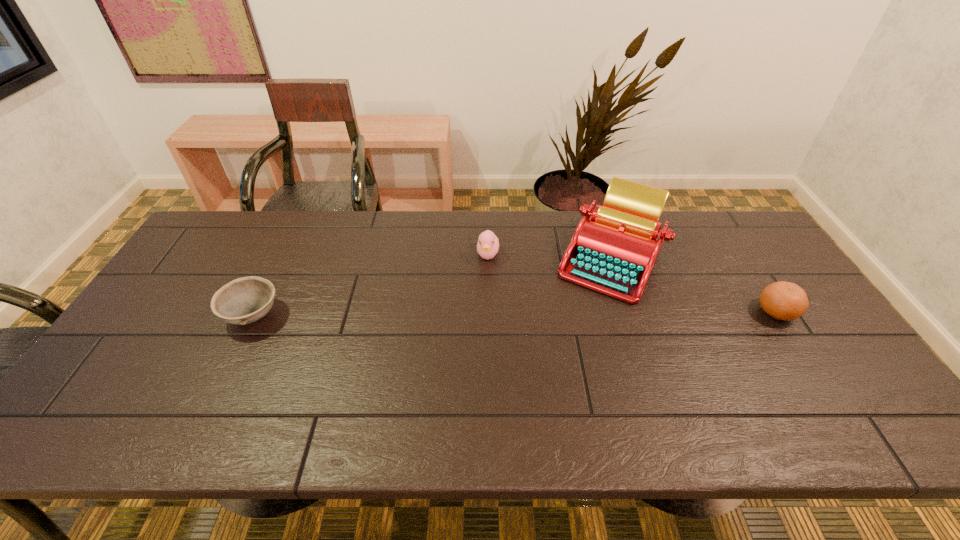
You are a GUI agent. You are given a task and a screenshot of the screen. Output one action in this format:
    pyautogui.click(x=<x>, y=<y>)
    Task: Click on the empty location between the second object from left to right and the tallest object
    This screenshot has height=540, width=960.
    Given the screenshot: What is the action you would take?
    pyautogui.click(x=549, y=256)

This screenshot has width=960, height=540. What are the coordinates of `vacant space in between the typewriter and the bowl` in the screenshot? It's located at pyautogui.click(x=432, y=287).

Locate an element on the screen. The width and height of the screenshot is (960, 540). unoccupied area between the tallest object and the rightmost object is located at coordinates (693, 285).

At what (x,y) coordinates should I click in order to perform the action: click on the third closest object to the tallest object. Please return your answer as a coordinate pair (x, y). The width and height of the screenshot is (960, 540). Looking at the image, I should click on (246, 300).

At what (x,y) coordinates should I click in order to perform the action: click on the third closest object to the rightmost object. Please return your answer as a coordinate pair (x, y). The image size is (960, 540). Looking at the image, I should click on (246, 300).

You are a GUI agent. You are given a task and a screenshot of the screen. Output one action in this format:
    pyautogui.click(x=<x>, y=<y>)
    Task: Click on the vacant region that satisfies the following two spatial constraints: 1. on the front side of the duckling; 2. on the right side of the clementine
    The image size is (960, 540).
    Given the screenshot: What is the action you would take?
    pyautogui.click(x=489, y=312)

Find the location of a particular element. vacant space that satisfies the following two spatial constraints: 1. on the front side of the third object from right to left; 2. on the left side of the clementine is located at coordinates (489, 312).

You are a GUI agent. You are given a task and a screenshot of the screen. Output one action in this format:
    pyautogui.click(x=<x>, y=<y>)
    Task: Click on the vacant area that satisfies the following two spatial constraints: 1. on the front side of the rightmost object; 2. on the right side of the second object from left to right
    This screenshot has width=960, height=540.
    Given the screenshot: What is the action you would take?
    pyautogui.click(x=489, y=312)